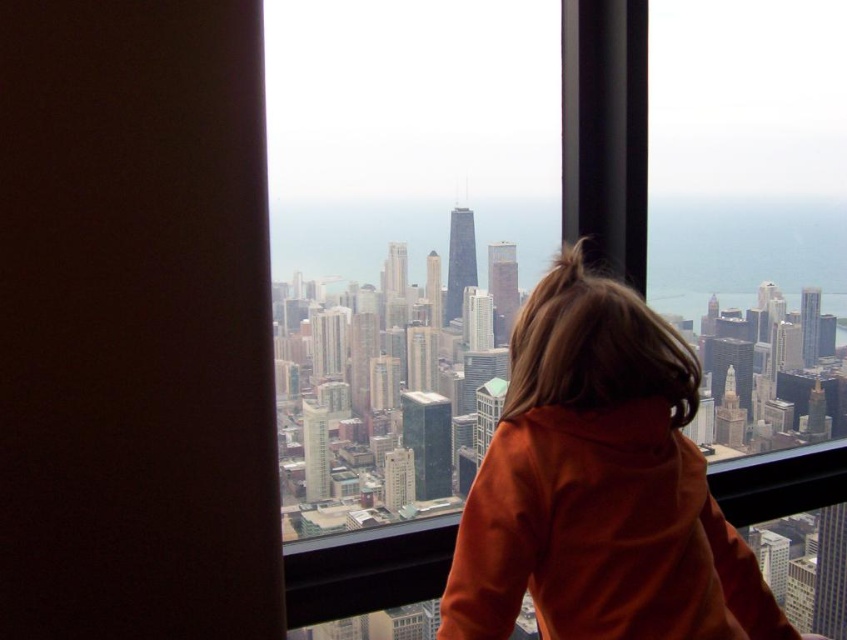
You are an interior designer assessing the view from a highrise office. You see the transparent glass window at center and the orange fleece at center. Which object would provide a better view of the cityscape outside?

The transparent glass window at center is bigger than the orange fleece at center, so it would provide a better view of the cityscape outside.

You are standing in the room and want to look at the two points in the image. Which point is closer to you, point (353, 276) or point (502, 412)?

Point (353, 276) is closer to the camera than point (502, 412), so the point closer to you is point (353, 276).